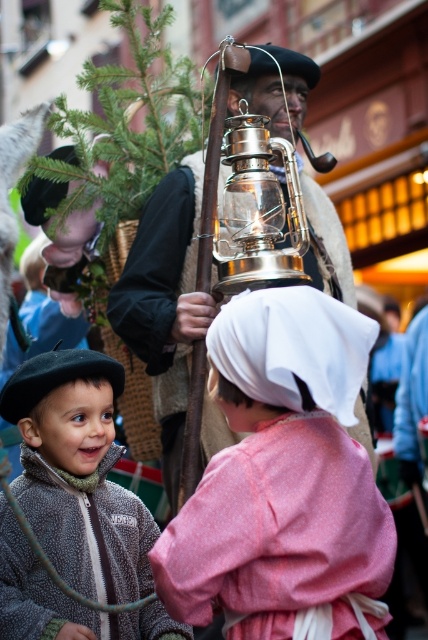
Question: Is fuzzy gray jacket at lower left to the left of shiny brass oil lamp at center from the viewer's perspective?

Choices:
 (A) no
 (B) yes

Answer: (B)

Question: Among these objects, which one is nearest to the camera?

Choices:
 (A) fuzzy gray jacket at lower left
 (B) shiny brass oil lamp at center
 (C) shiny brass lantern at center
 (D) pink fabric dress at center

Answer: (D)

Question: Can you confirm if pink fabric dress at center is positioned to the left of shiny brass lantern at center?

Choices:
 (A) yes
 (B) no

Answer: (A)

Question: Which object appears closest to the camera in this image?

Choices:
 (A) shiny brass lantern at center
 (B) fuzzy gray jacket at lower left
 (C) pink fabric dress at center
 (D) shiny brass oil lamp at center

Answer: (C)

Question: Which object is positioned farthest from the shiny brass lantern at center?

Choices:
 (A) fuzzy gray jacket at lower left
 (B) pink fabric dress at center
 (C) shiny brass oil lamp at center

Answer: (C)

Question: Does shiny brass lantern at center have a greater width compared to shiny brass oil lamp at center?

Choices:
 (A) no
 (B) yes

Answer: (B)